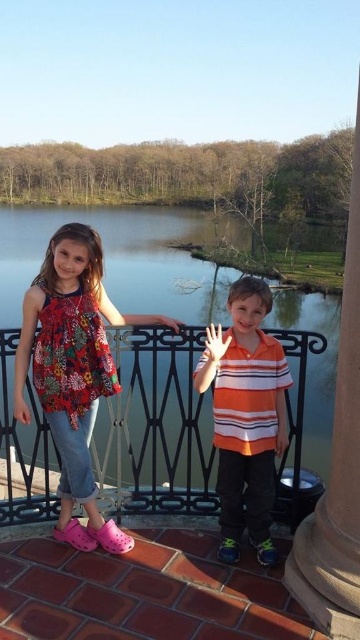
Question: Which of the following is the farthest from the observer?

Choices:
 (A) white matte hand at center
 (B) matte black hand at upper center
 (C) orange striped shirt at center

Answer: (B)

Question: Can you confirm if smooth water at center is wider than white matte hand at center?

Choices:
 (A) no
 (B) yes

Answer: (B)

Question: Which point is closer to the camera?

Choices:
 (A) smooth stone pillar at right
 (B) orange striped shirt at center
 (C) floral fabric blouse at upper left
 (D) matte black hand at upper center

Answer: (A)

Question: Which object appears farthest from the camera in this image?

Choices:
 (A) white matte hand at center
 (B) matte black hand at upper center
 (C) orange striped shirt at center
 (D) floral fabric blouse at upper left

Answer: (B)

Question: Does smooth water at center appear over smooth stone pillar at right?

Choices:
 (A) no
 (B) yes

Answer: (A)

Question: Can you confirm if smooth water at center is bigger than smooth stone pillar at right?

Choices:
 (A) yes
 (B) no

Answer: (B)